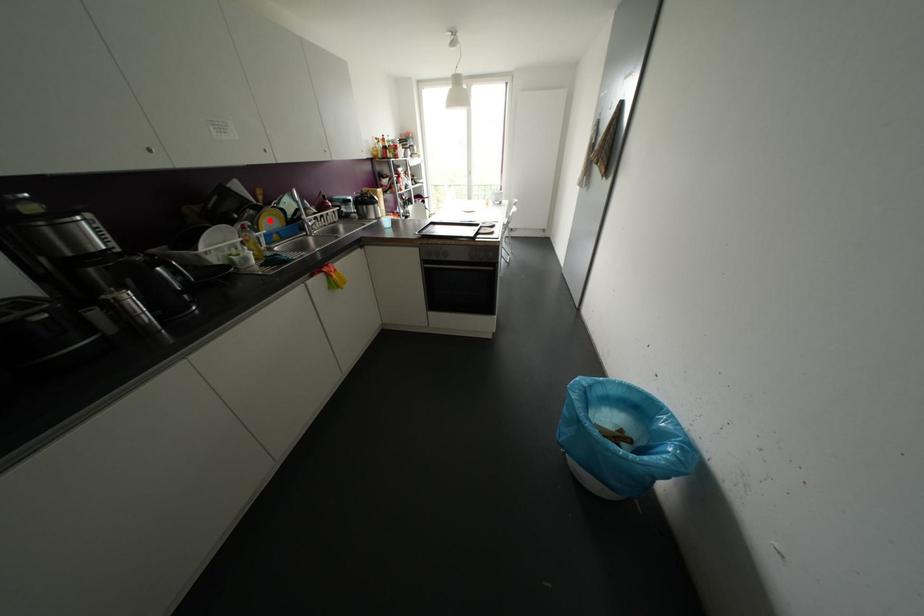
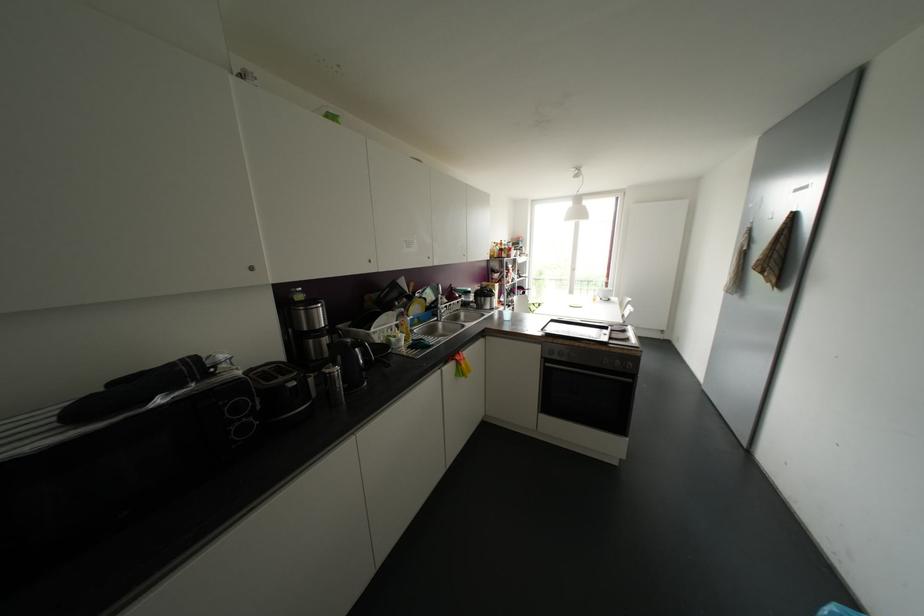
Find the pixel in the second image that matches the highlighted location in the first image.

(416, 307)